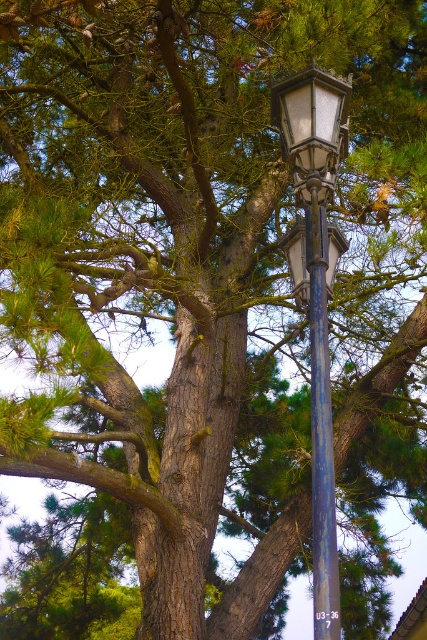
Question: Estimate the real-world distances between objects in this image. Which object is closer to the rusty metal pole at center?

Choices:
 (A) matte glass streetlamp at center
 (B) matte black street light at center

Answer: (B)

Question: Which object appears farthest from the camera in this image?

Choices:
 (A) rusty metal pole at center
 (B) matte black street light at center

Answer: (B)

Question: Is matte black street light at center positioned before rusty metal pole at center?

Choices:
 (A) no
 (B) yes

Answer: (A)

Question: Can you confirm if matte black street light at center is wider than rusty metal pole at center?

Choices:
 (A) no
 (B) yes

Answer: (B)

Question: Which object is the farthest from the rusty metal pole at center?

Choices:
 (A) matte glass streetlamp at center
 (B) matte black street light at center

Answer: (A)

Question: Does matte black street light at center appear over rusty metal pole at center?

Choices:
 (A) no
 (B) yes

Answer: (B)